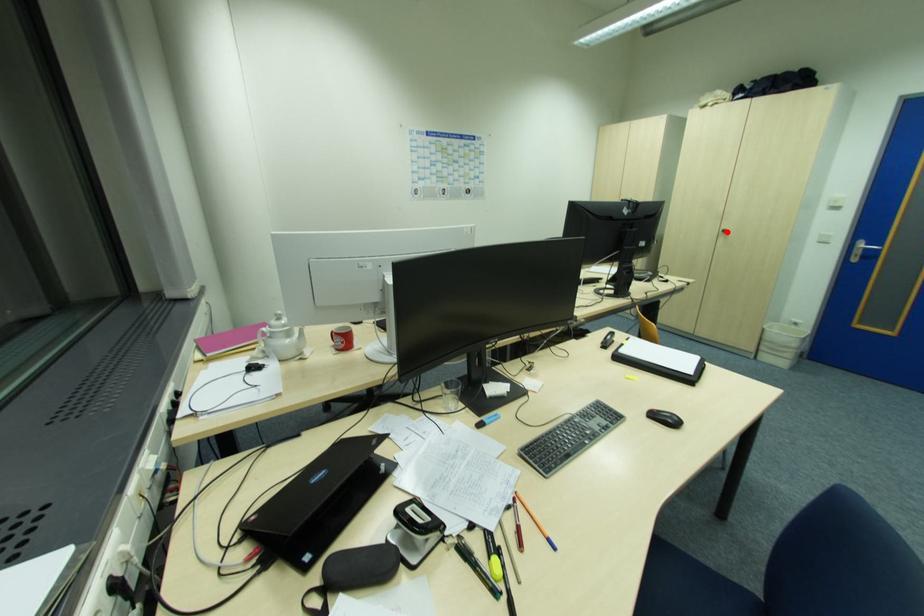
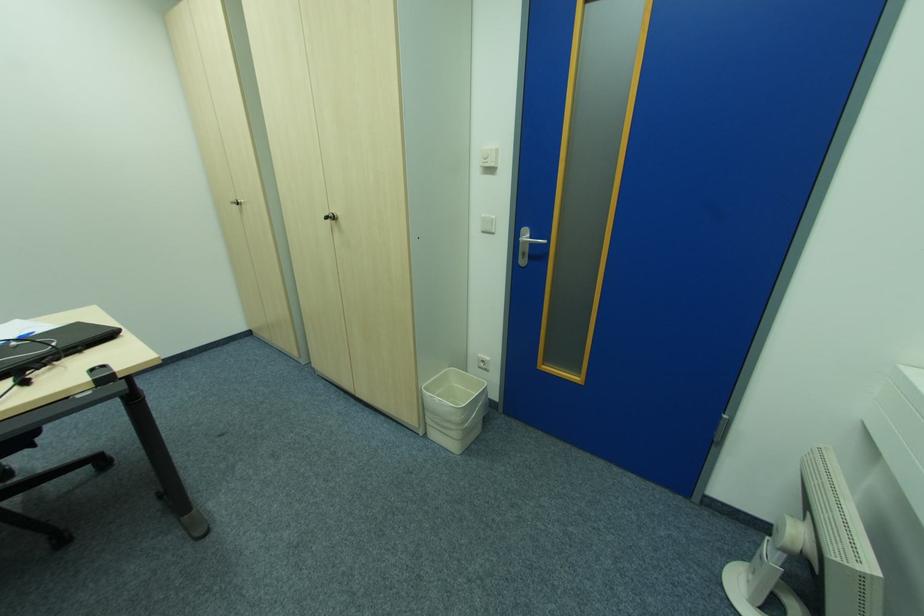
Find the pixel in the second image that matches the highlighted location in the first image.

(334, 219)